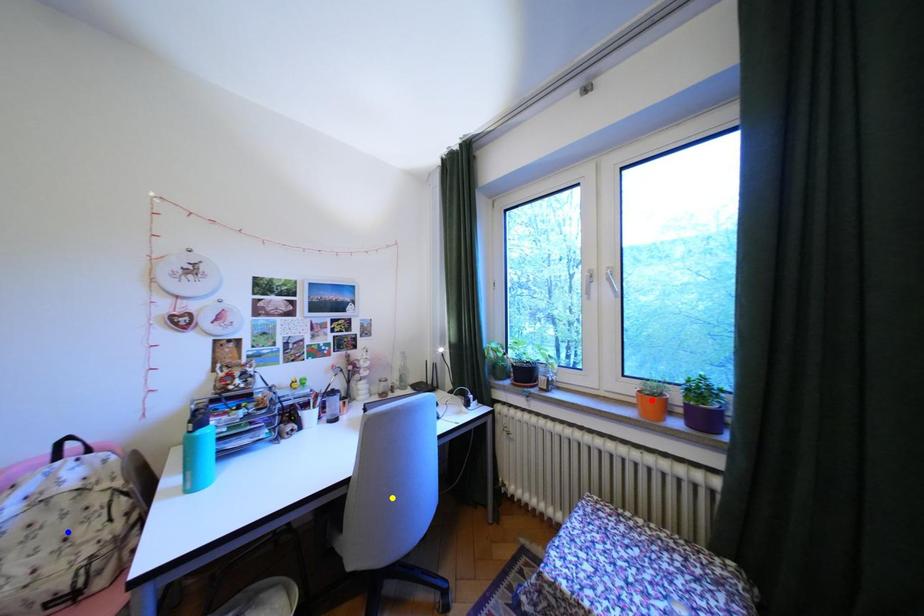
Order these from nearest to farthest:
1. red point
2. yellow point
3. blue point

blue point, red point, yellow point